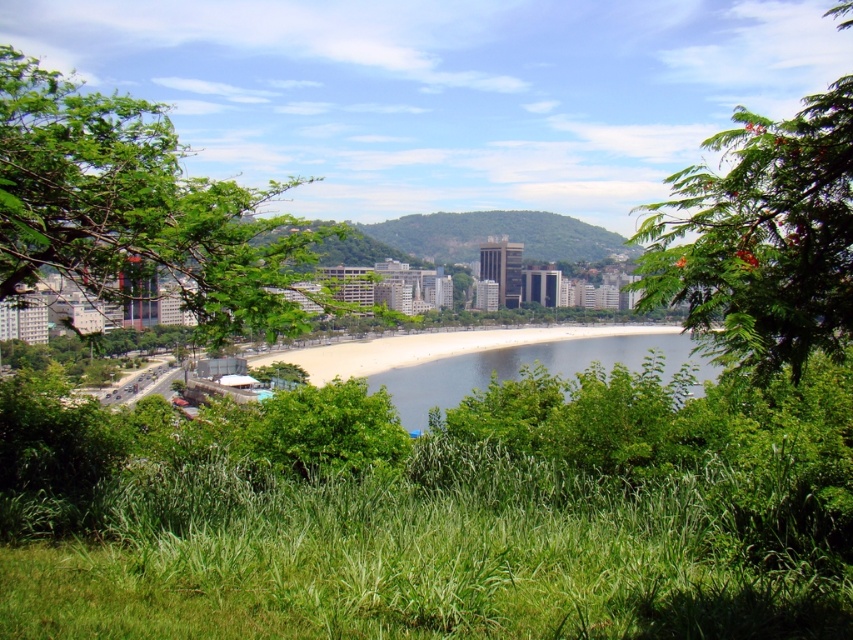
Question: Can you confirm if green grass at lower center is positioned below green leafy tree at center?

Choices:
 (A) yes
 (B) no

Answer: (A)

Question: Does green grass at lower center lie behind green leafy tree at center?

Choices:
 (A) no
 (B) yes

Answer: (A)

Question: Is green leafy tree at upper right below white sand beach at center?

Choices:
 (A) no
 (B) yes

Answer: (A)

Question: Estimate the real-world distances between objects in this image. Which object is farther from the white sand beach at center?

Choices:
 (A) green grass at lower center
 (B) green leafy tree at upper right

Answer: (B)

Question: Which point is closer to the camera taking this photo?

Choices:
 (A) (793, 378)
 (B) (645, 328)
 (C) (398, 518)

Answer: (C)

Question: Which of the following is the closest to the observer?

Choices:
 (A) (450, 627)
 (B) (773, 228)

Answer: (A)